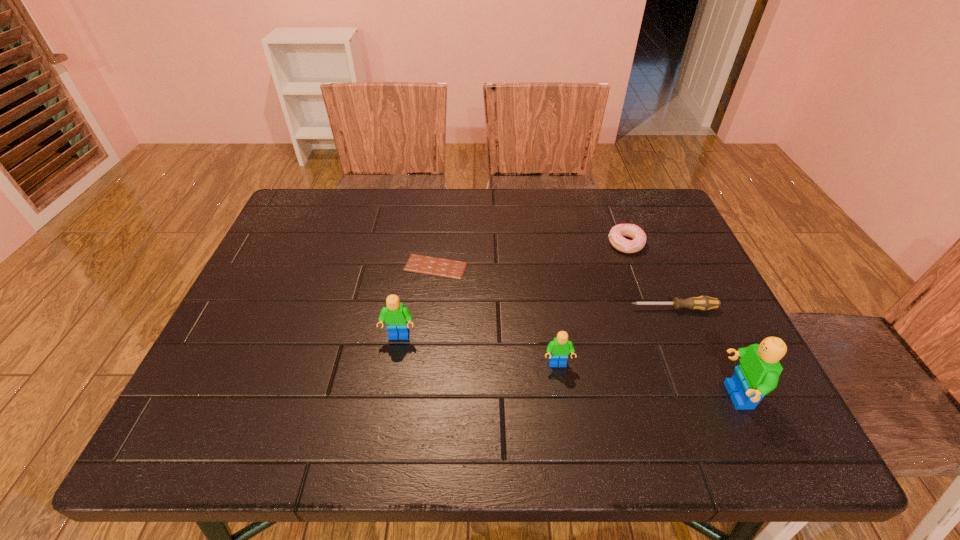
This screenshot has height=540, width=960. Find the location of `vacant space located 0.090m on the face of the second shortest Lego`. vacant space located 0.090m on the face of the second shortest Lego is located at coordinates (393, 379).

You are a GUI agent. You are given a task and a screenshot of the screen. Output one action in this format:
    pyautogui.click(x=<x>, y=<y>)
    Task: Click on the vacant area located 0.140m on the face of the tallest object
    This screenshot has width=960, height=540.
    Given the screenshot: What is the action you would take?
    pyautogui.click(x=652, y=396)

Image resolution: width=960 pixels, height=540 pixels. I want to click on free space located on the face of the tallest object, so click(x=667, y=396).

The image size is (960, 540). I want to click on vacant space located on the face of the tallest object, so click(612, 396).

Where is `vacant space located 0.120m on the left of the doughnut`? vacant space located 0.120m on the left of the doughnut is located at coordinates coord(564,244).

Identify the location of free region located on the left of the shortest object. (270, 267).

At what (x,y) coordinates should I click in order to perform the action: click on free region located at the tip of the fourth nearest object. Please return your answer as a coordinate pair (x, y). This screenshot has width=960, height=540. Looking at the image, I should click on (563, 308).

Where is `vacant region located 0.130m at the tip of the fourth nearest object`? The height and width of the screenshot is (540, 960). vacant region located 0.130m at the tip of the fourth nearest object is located at coordinates (575, 308).

The width and height of the screenshot is (960, 540). Find the location of `vacant area located 0.370m at the tip of the fourth nearest object`. vacant area located 0.370m at the tip of the fourth nearest object is located at coordinates (474, 308).

I want to click on object that is at the far edge, so click(616, 234).